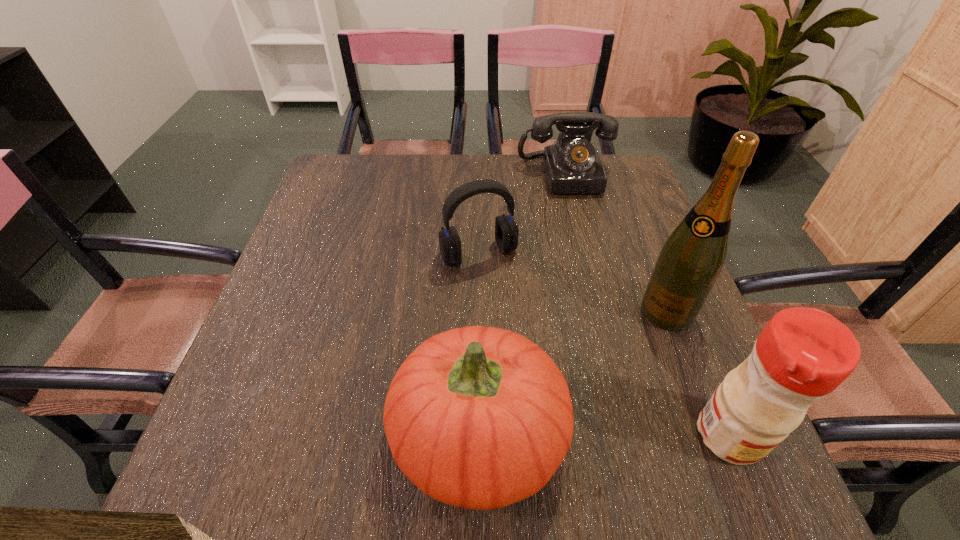
This screenshot has width=960, height=540. Identify the location of free spot on the desktop that is between the pumpkin and the condiment and is positioned on the dial of the telephone. coord(635,435).

Where is `vacant space on the desktop that is between the third tallest object and the condiment and is positioned on the headband of the second farthest object`? This screenshot has width=960, height=540. vacant space on the desktop that is between the third tallest object and the condiment and is positioned on the headband of the second farthest object is located at coordinates (569, 435).

The width and height of the screenshot is (960, 540). I want to click on vacant space on the desktop that is between the third tallest object and the second tallest object and is positioned on the front-facing side of the third nearest object, so click(x=582, y=435).